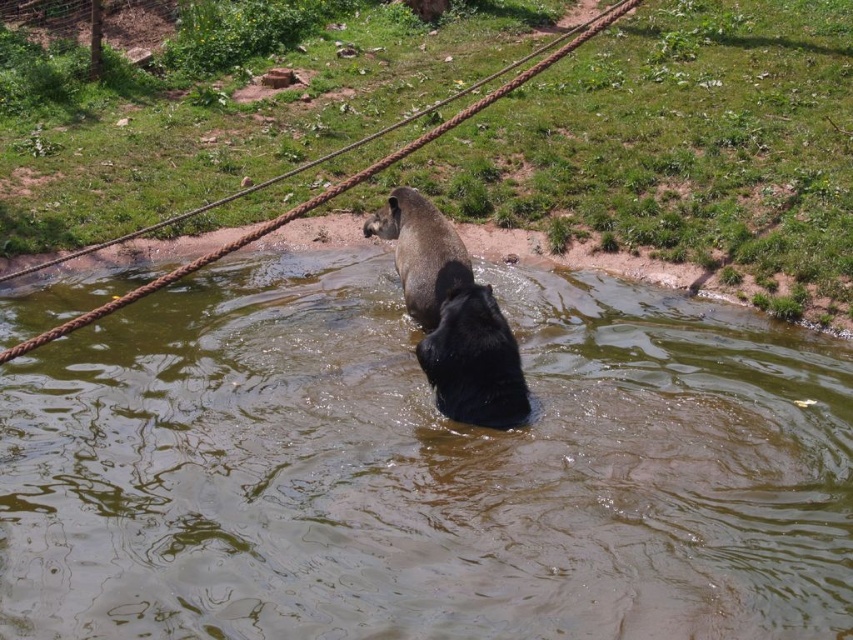
Question: Among these objects, which one is farthest from the camera?

Choices:
 (A) brown fur dog at center
 (B) brown murky water at center

Answer: (A)

Question: Which object is closer to the camera taking this photo?

Choices:
 (A) brown murky water at center
 (B) brown fur dog at center

Answer: (A)

Question: Which of the following is the farthest from the observer?

Choices:
 (A) brown murky water at center
 (B) brown fur dog at center

Answer: (B)

Question: Is brown murky water at center to the left of brown fur dog at center from the viewer's perspective?

Choices:
 (A) no
 (B) yes

Answer: (A)

Question: Can you confirm if brown murky water at center is thinner than brown fur dog at center?

Choices:
 (A) yes
 (B) no

Answer: (A)

Question: Is the position of brown murky water at center more distant than that of brown fur dog at center?

Choices:
 (A) yes
 (B) no

Answer: (B)